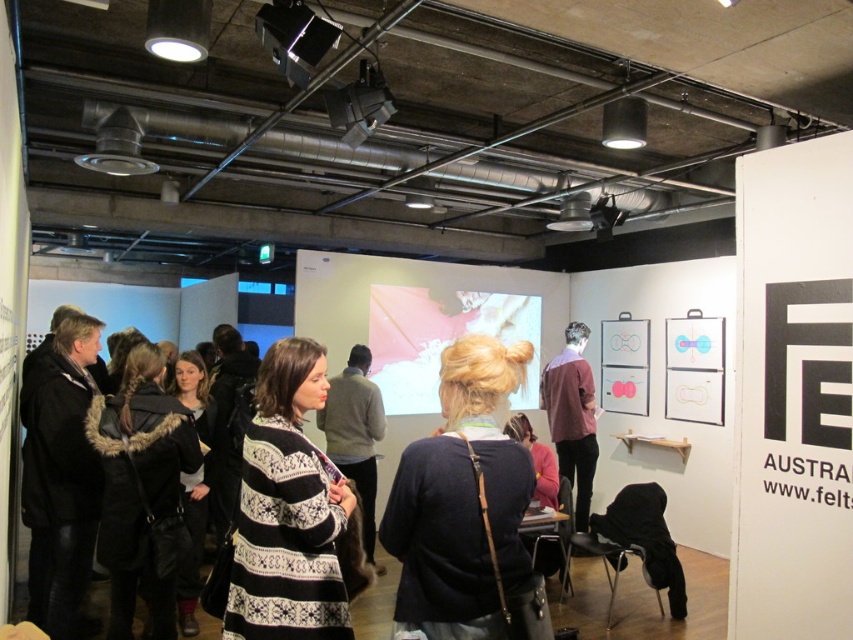
Question: Does dark blue sweater at center lie in front of black plastic projector at upper center?

Choices:
 (A) yes
 (B) no

Answer: (A)

Question: Based on their relative distances, which object is nearer to the dark blue sweater at center?

Choices:
 (A) maroon sweater at center
 (B) striped sweater at center
 (C) black knitted sweater at center
 (D) black plastic projector at upper center

Answer: (C)

Question: Among these points, which one is farthest from the camera?

Choices:
 (A) (447, 330)
 (B) (375, 392)

Answer: (A)

Question: Can you confirm if striped sweater at center is smaller than maroon sweater at center?

Choices:
 (A) yes
 (B) no

Answer: (B)

Question: Which object is positioned closest to the dark blue sweater at center?

Choices:
 (A) matte white projection screen at center
 (B) black knitted sweater at center
 (C) maroon sweater at center
 (D) striped sweater at center

Answer: (B)

Question: Is black knitted sweater at center below matte white projection screen at center?

Choices:
 (A) yes
 (B) no

Answer: (A)